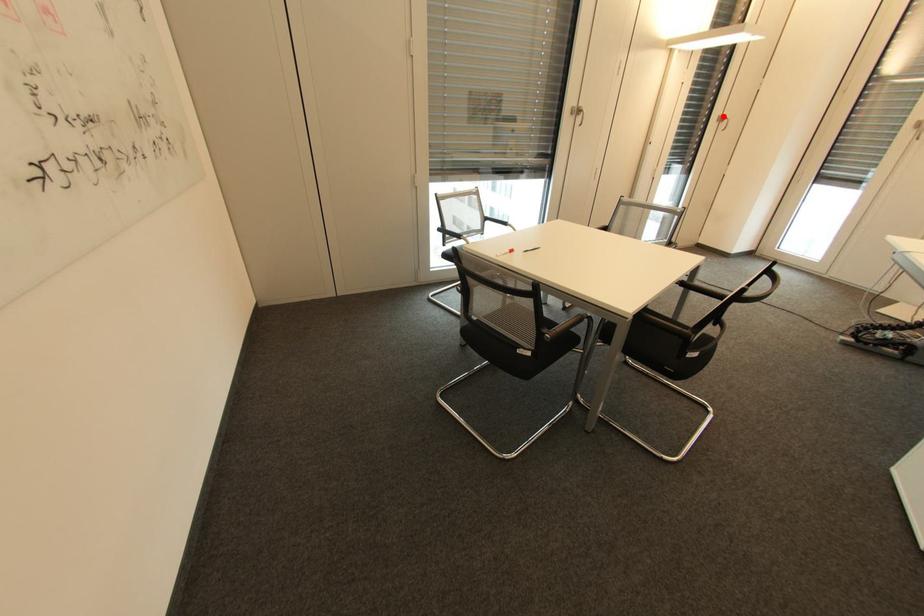
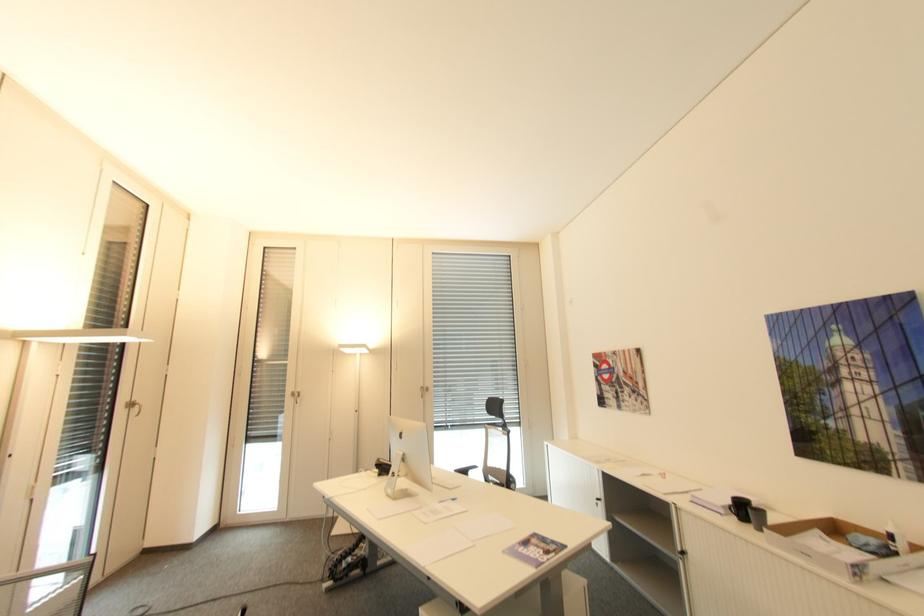
Question: I am providing you with two images of the same scene from different viewpoints. In image1, a red point is highlighted. Considering the same 3D point in image2, which of the following is correct?

Choices:
 (A) It is closer
 (B) It is farther

Answer: (A)